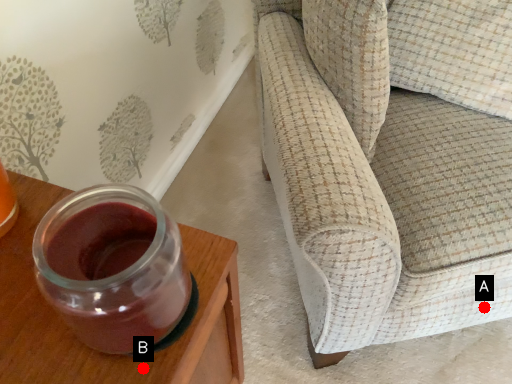
Question: Two points are circled on the image, labeled by A and B beside each circle. Among these points, which one is nearest to the camera?

Choices:
 (A) A is closer
 (B) B is closer

Answer: (B)